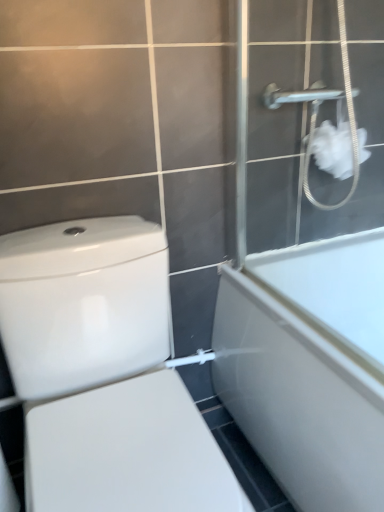
Describe the element at coordinates (307, 125) in the screenshot. This screenshot has width=384, height=512. I see `white matte shower screen at upper right` at that location.

Locate an element on the screen. The width and height of the screenshot is (384, 512). white glossy toilet at lower left is located at coordinates (103, 373).

Is white matte shower screen at upper right behind white fluffy tissue at upper right?

No.

I want to click on screen door lying above the white fluffy tissue at upper right (from the image's perspective), so click(307, 125).

Considering the sizes of white matte shower screen at upper right and white fluffy tissue at upper right in the image, is white matte shower screen at upper right taller or shorter than white fluffy tissue at upper right?

white matte shower screen at upper right is taller than white fluffy tissue at upper right.

Can we say white matte shower screen at upper right lies outside white fluffy tissue at upper right?

Yes, white matte shower screen at upper right is outside of white fluffy tissue at upper right.

From a real-world perspective, which object stands above the other?

From a 3D spatial view, white fluffy tissue at upper right is above.

In the scene shown: Would you say white glossy toilet at lower left is inside or outside white fluffy tissue at upper right?

white glossy toilet at lower left is located beyond the bounds of white fluffy tissue at upper right.

Between white glossy toilet at lower left and white fluffy tissue at upper right, which one has larger size?

With larger size is white glossy toilet at lower left.

Consider the image. Are white glossy toilet at lower left and white fluffy tissue at upper right beside each other?

No, white glossy toilet at lower left is not touching white fluffy tissue at upper right.

Is point (329, 170) positioned in front of point (323, 194)?

Yes, point (329, 170) is in front of point (323, 194).

Is white fluffy tissue at upper right not close to white matte shower screen at upper right?

No, white fluffy tissue at upper right is not far away from white matte shower screen at upper right.

Is white fluffy tissue at upper right oriented towards white matte shower screen at upper right?

Yes, white fluffy tissue at upper right is oriented towards white matte shower screen at upper right.

From a real-world perspective, is white fluffy tissue at upper right positioned above or below white matte shower screen at upper right?

In terms of real-world spatial position, white fluffy tissue at upper right is below white matte shower screen at upper right.

How different are the orientations of white fluffy tissue at upper right and white glossy bathtub at right in degrees?

The angle between the facing direction of white fluffy tissue at upper right and the facing direction of white glossy bathtub at right is 87.9 degrees.

Image resolution: width=384 pixels, height=512 pixels. I want to click on bathtub that is on the right side of white fluffy tissue at upper right, so click(309, 367).

Which object is thinner, white fluffy tissue at upper right or white glossy bathtub at right?

With smaller width is white fluffy tissue at upper right.

Which of these two, white fluffy tissue at upper right or white glossy bathtub at right, stands shorter?

white fluffy tissue at upper right is shorter.

Considering the relative sizes of white matte shower screen at upper right and white glossy toilet at lower left in the image provided, is white matte shower screen at upper right wider than white glossy toilet at lower left?

No, white matte shower screen at upper right is not wider than white glossy toilet at lower left.

Which is correct: white matte shower screen at upper right is inside white glossy toilet at lower left, or outside of it?

white matte shower screen at upper right is not inside white glossy toilet at lower left, it's outside.

Who is more distant, white matte shower screen at upper right or white glossy toilet at lower left?

white matte shower screen at upper right.

From a real-world perspective, is white matte shower screen at upper right physically located above or below white glossy toilet at lower left?

white matte shower screen at upper right is above white glossy toilet at lower left.

Is white fluffy tissue at upper right completely or partially outside of white glossy toilet at lower left?

Yes, white fluffy tissue at upper right is not within white glossy toilet at lower left.

Is there a large distance between white fluffy tissue at upper right and white glossy toilet at lower left?

No, white fluffy tissue at upper right is not far away from white glossy toilet at lower left.

Between point (344, 134) and point (30, 303), which one is positioned behind?

Positioned behind is point (344, 134).

Visually, is white glossy bathtub at right positioned to the left or to the right of white fluffy tissue at upper right?

From the image, it's evident that white glossy bathtub at right is to the right of white fluffy tissue at upper right.

Is white fluffy tissue at upper right a part of white glossy bathtub at right?

No, white fluffy tissue at upper right is not a part of white glossy bathtub at right.

Is white glossy bathtub at right oriented towards white fluffy tissue at upper right?

No, white glossy bathtub at right is not aimed at white fluffy tissue at upper right.

Considering the relative sizes of white glossy bathtub at right and white fluffy tissue at upper right in the image provided, is white glossy bathtub at right bigger than white fluffy tissue at upper right?

Correct, white glossy bathtub at right is larger in size than white fluffy tissue at upper right.

I want to click on screen door in front of the white fluffy tissue at upper right, so click(x=307, y=125).

Find the location of a particular element. toilet paper above the white glossy toilet at lower left (from the image's perspective) is located at coordinates (333, 149).

When comparing their distances from white glossy toilet at lower left, does white glossy bathtub at right or white matte shower screen at upper right seem closer?

Among the two, white glossy bathtub at right is located nearer to white glossy toilet at lower left.

Considering their positions, is white glossy toilet at lower left positioned further to white matte shower screen at upper right than white glossy bathtub at right?

white glossy toilet at lower left is positioned further to the anchor white matte shower screen at upper right.

Looking at the image, which one is located closer to white glossy toilet at lower left, white fluffy tissue at upper right or white glossy bathtub at right?

white glossy bathtub at right lies closer to white glossy toilet at lower left than the other object.

Looking at the image, which one is located closer to white glossy bathtub at right, white fluffy tissue at upper right or white matte shower screen at upper right?

white matte shower screen at upper right is closer to white glossy bathtub at right.

Considering their positions, is white fluffy tissue at upper right positioned further to white matte shower screen at upper right than white glossy toilet at lower left?

white glossy toilet at lower left.

Looking at the image, which one is located closer to white glossy toilet at lower left, white glossy bathtub at right or white fluffy tissue at upper right?

white glossy bathtub at right lies closer to white glossy toilet at lower left than the other object.

In the scene shown: From the image, which object appears to be nearer to white fluffy tissue at upper right, white matte shower screen at upper right or white glossy toilet at lower left?

The object closer to white fluffy tissue at upper right is white matte shower screen at upper right.

Estimate the real-world distances between objects in this image. Which object is closer to white fluffy tissue at upper right, white matte shower screen at upper right or white glossy bathtub at right?

The object closer to white fluffy tissue at upper right is white matte shower screen at upper right.

At what (x,y) coordinates should I click in order to perform the action: click on toilet paper between white matte shower screen at upper right and white glossy bathtub at right from top to bottom. Please return your answer as a coordinate pair (x, y). This screenshot has height=512, width=384. Looking at the image, I should click on (333, 149).

Where is `toilet paper that lies between white matte shower screen at upper right and white glossy toilet at lower left from top to bottom`? Image resolution: width=384 pixels, height=512 pixels. toilet paper that lies between white matte shower screen at upper right and white glossy toilet at lower left from top to bottom is located at coordinates (333, 149).

The width and height of the screenshot is (384, 512). In order to click on bathtub that lies between white fluffy tissue at upper right and white glossy toilet at lower left from top to bottom in this screenshot , I will do `click(309, 367)`.

Locate an element on the screen. bathtub between white matte shower screen at upper right and white glossy toilet at lower left vertically is located at coordinates (309, 367).